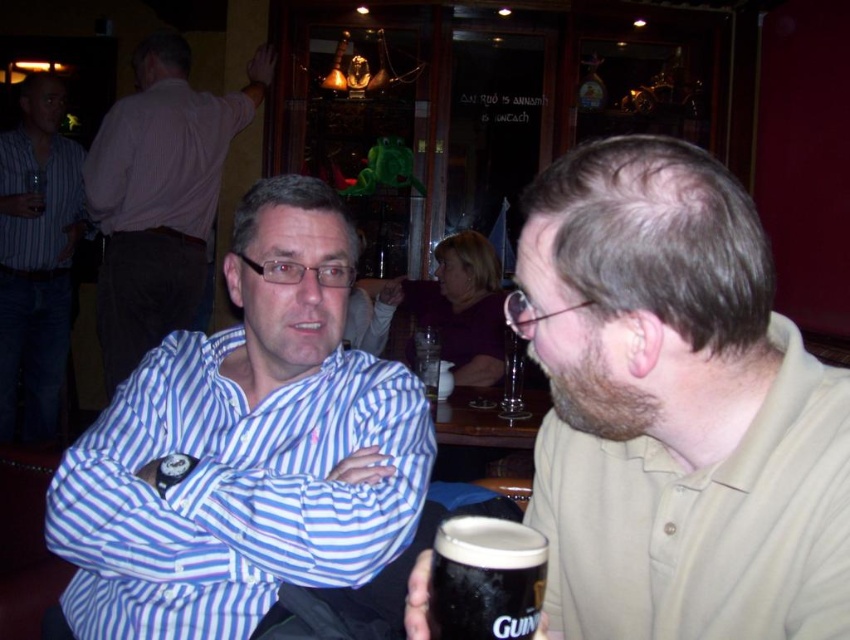
You are a bartender at the pub and want to place a new drink order on the table where the two men are sitting. The point where you need to place the drink is at coordinates point (338, 540). If your arm can reach up to 40 inches, will you be able to reach that point from your current position?

The point (338, 540) is 39.01 inches away from the camera, so yes, the bartender can reach it since their arm can extend up to 40 inches.

You are a bartender who needs to place a large tray of drinks between the blue striped shirt at center and the light brown cotton shirt at upper left. Based on their positions, will the tray fit between them if the tray is 1.2 meters wide?

The blue striped shirt at center might be wider than light brown cotton shirt at upper left, so the distance between them could be sufficient to accommodate the 1.2 meter tray. However, since the exact width isn